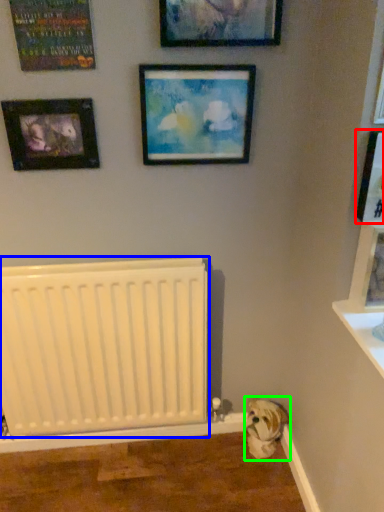
Question: Estimate the real-world distances between objects in this image. Which object is farther from picture frame (highlighted by a red box), radiator (highlighted by a blue box) or animal (highlighted by a green box)?

Choices:
 (A) radiator
 (B) animal

Answer: (B)